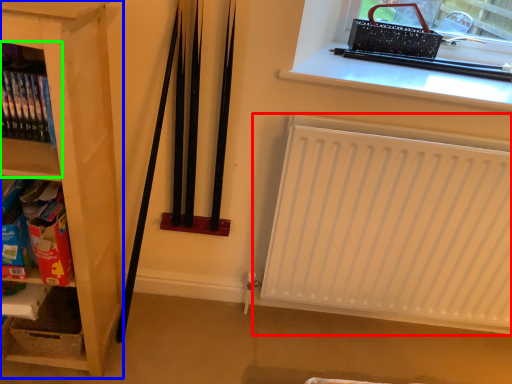
Question: Which object is the closest to the heater (highlighted by a red box)? Choose among these: shelf (highlighted by a blue box) or shelf (highlighted by a green box).

Choices:
 (A) shelf
 (B) shelf

Answer: (A)